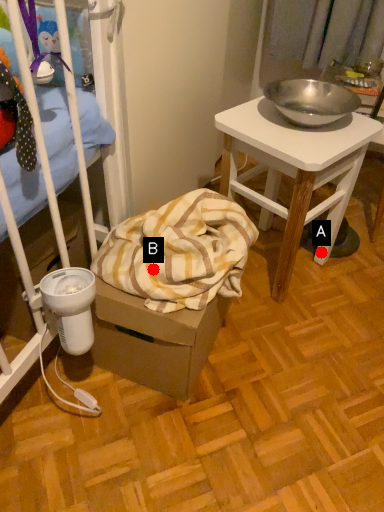
Question: Two points are circled on the image, labeled by A and B beside each circle. Which point appears closest to the camera in this image?

Choices:
 (A) A is closer
 (B) B is closer

Answer: (B)